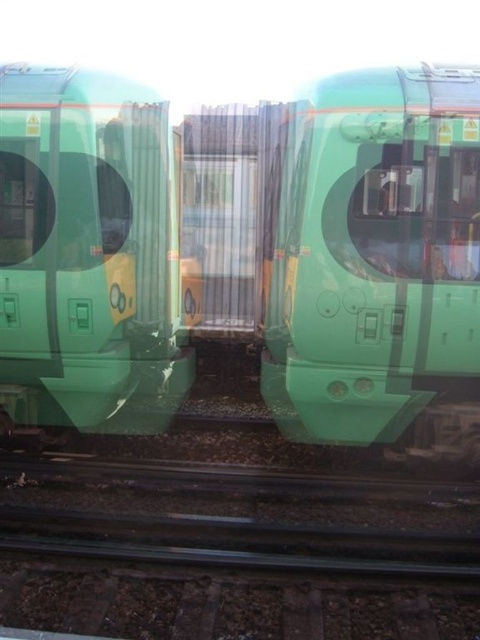
In order to click on green matte train at center in this screenshot , I will do `click(244, 252)`.

Locate an element on the screen. This screenshot has height=640, width=480. green matte train at center is located at coordinates (244, 252).

Between black metal train track at center and green matte train at left, which one has more height?

green matte train at left is taller.

Which of these two, black metal train track at center or green matte train at left, stands shorter?

Standing shorter between the two is black metal train track at center.

The width and height of the screenshot is (480, 640). I want to click on black metal train track at center, so click(x=233, y=552).

Between point (249, 120) and point (415, 568), which one is positioned in front?

Point (415, 568) is more forward.

What do you see at coordinates (244, 252) in the screenshot? The image size is (480, 640). I see `green matte train at center` at bounding box center [244, 252].

This screenshot has height=640, width=480. Find the location of `green matte train at center`. green matte train at center is located at coordinates (244, 252).